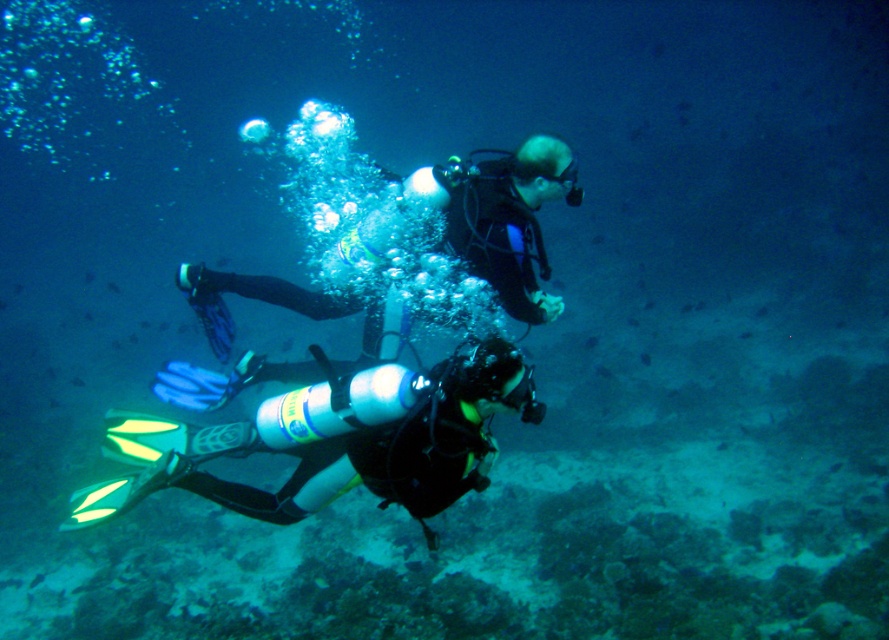
Question: Does neon yellow fins at center appear on the right side of black matte scuba diver at center?

Choices:
 (A) no
 (B) yes

Answer: (A)

Question: Which object appears farthest from the camera in this image?

Choices:
 (A) neon yellow fins at center
 (B) black matte scuba diver at center

Answer: (B)

Question: Does neon yellow fins at center appear on the left side of black matte scuba diver at center?

Choices:
 (A) no
 (B) yes

Answer: (B)

Question: Which object is farther from the camera taking this photo?

Choices:
 (A) neon yellow fins at center
 (B) black matte scuba diver at center

Answer: (B)

Question: Is neon yellow fins at center to the left of black matte scuba diver at center from the viewer's perspective?

Choices:
 (A) no
 (B) yes

Answer: (B)

Question: Which object is farther from the camera taking this photo?

Choices:
 (A) neon yellow fins at center
 (B) black matte scuba diver at center

Answer: (B)